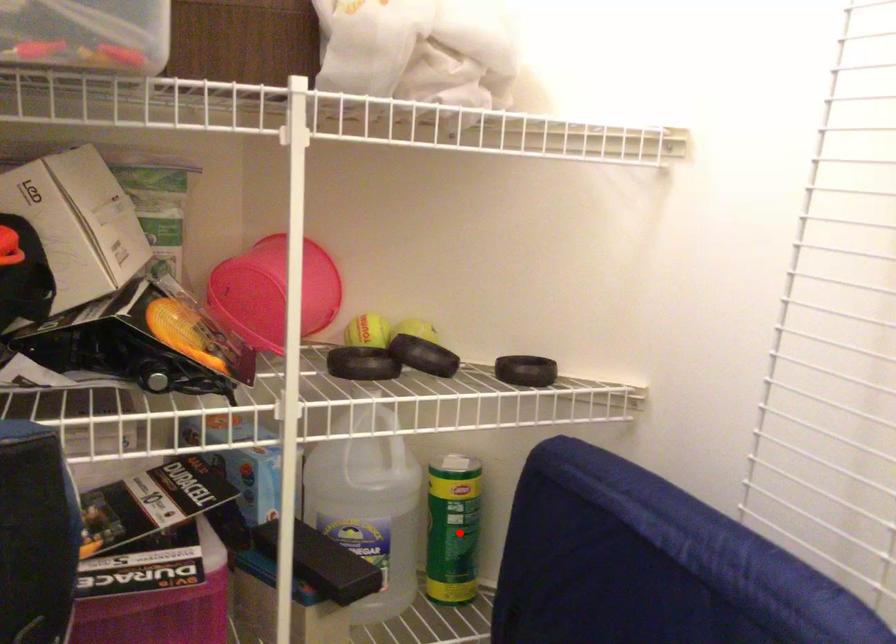
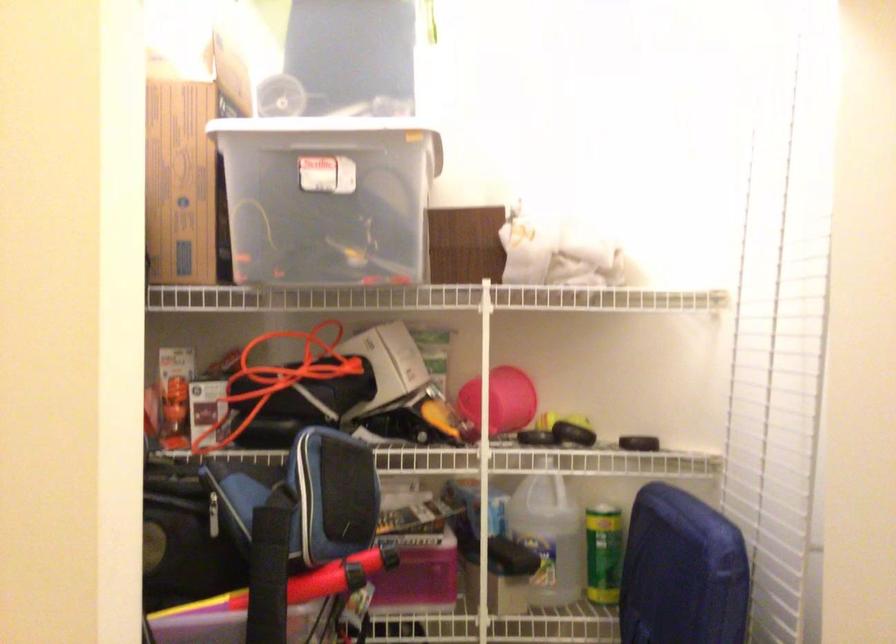
The point at the highlighted location is marked in the first image. Where is the corresponding point in the second image?

(604, 554)